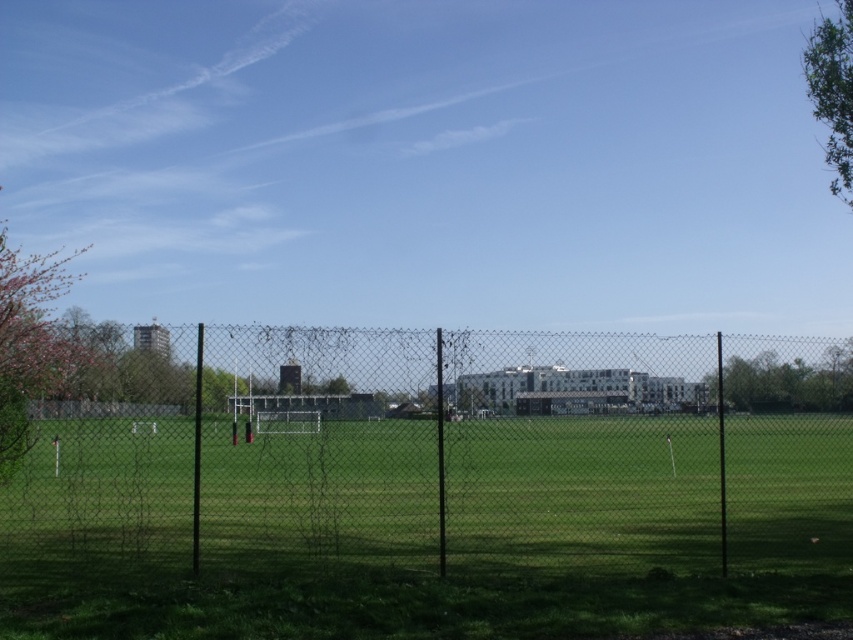
You are standing on the sports field and want to take a photo of both the pink blossoming tree at left and the green leafy tree at upper right. Which tree will appear closer to the camera in the photo?

The pink blossoming tree at left will appear closer to the camera in the photo because it is positioned in front of the green leafy tree at upper right.